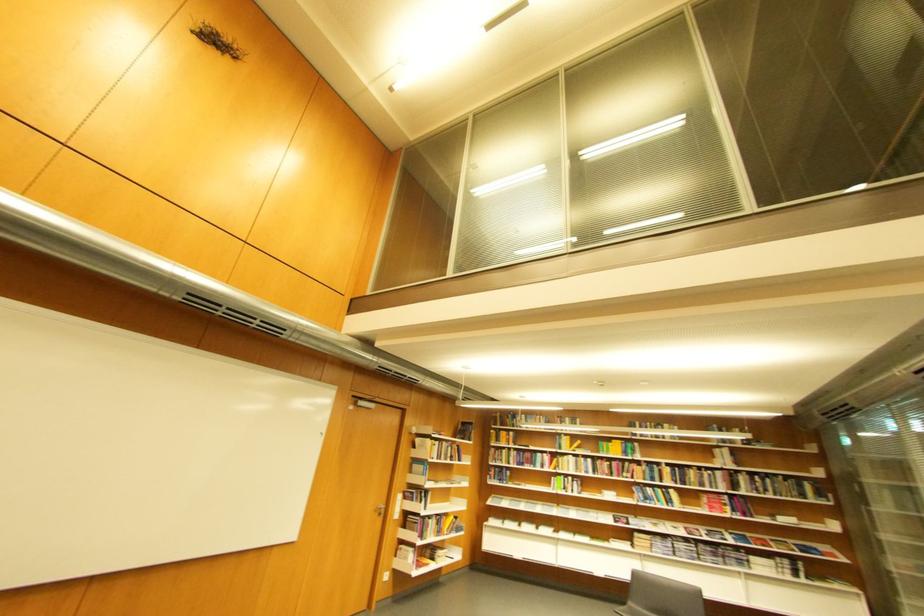
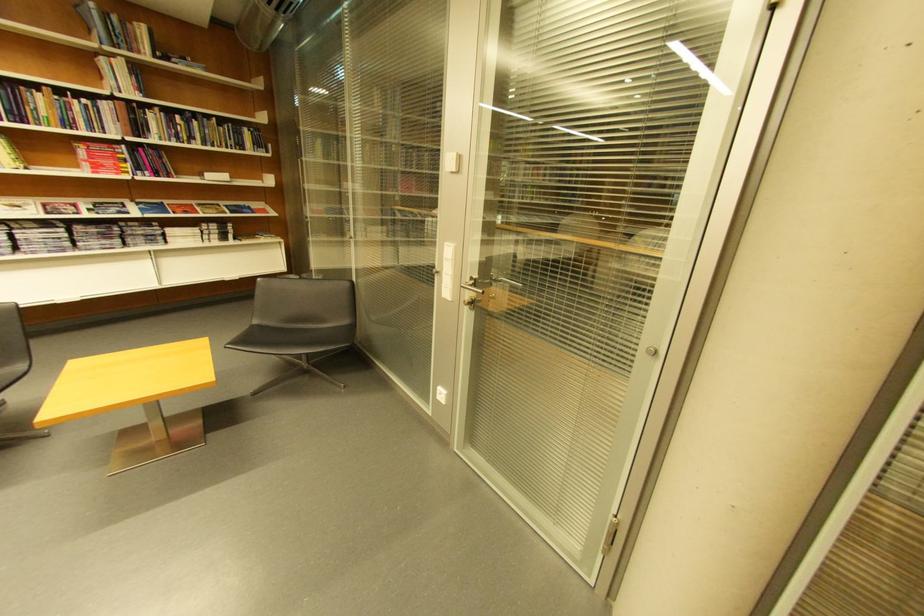
Find the pixel in the second image that matches the point at 779,482 in the first image.

(205, 124)